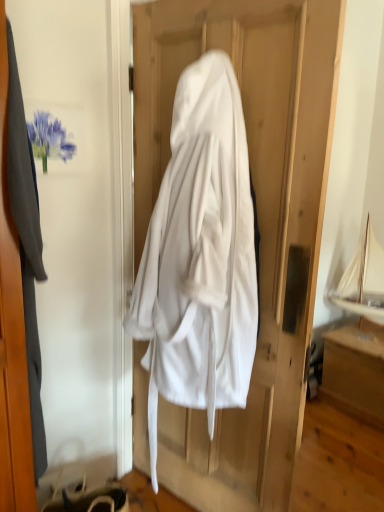
Find the location of a particular element. white fabric hanger at lower left is located at coordinates (79, 486).

Find the location of a particular element. white fabric hanger at lower left is located at coordinates (79, 486).

Is point (320, 165) closer or farther from the camera than point (114, 358)?

Clearly, point (320, 165) is closer to the camera than point (114, 358).

Is white cloth at center shorter than gray fabric screen door at left?

No.

Which is more to the left, white cloth at center or gray fabric screen door at left?

Positioned to the left is gray fabric screen door at left.

In the scene shown: From a real-world perspective, is white cloth at center on gray fabric screen door at left?

No.

Does white cloth at center have a larger size compared to wooden drawer at lower right?

Yes, white cloth at center is bigger than wooden drawer at lower right.

Where is `drawer directly beneath the white cloth at center (from a real-world perspective)`? drawer directly beneath the white cloth at center (from a real-world perspective) is located at coordinates (354, 382).

Considering the points (291, 274) and (327, 368), which point is behind, point (291, 274) or point (327, 368)?

Point (327, 368)

Are white fabric hanger at lower left and wooden drawer at lower right making contact?

No, white fabric hanger at lower left is not in contact with wooden drawer at lower right.

Based on their positions, is white fabric hanger at lower left located to the left or right of wooden drawer at lower right?

Clearly, white fabric hanger at lower left is on the left of wooden drawer at lower right in the image.

Is white fabric hanger at lower left thinner than wooden drawer at lower right?

Correct, the width of white fabric hanger at lower left is less than that of wooden drawer at lower right.

Where is `hanger in front of the wooden drawer at lower right`? hanger in front of the wooden drawer at lower right is located at coordinates (79, 486).

Does gray fabric screen door at left have a larger size compared to white fabric hanger at lower left?

Indeed, gray fabric screen door at left has a larger size compared to white fabric hanger at lower left.

Measure the distance between gray fabric screen door at left and white fabric hanger at lower left.

20.13 inches.

Is gray fabric screen door at left not inside white fabric hanger at lower left?

Absolutely, gray fabric screen door at left is external to white fabric hanger at lower left.

How different are the orientations of gray fabric screen door at left and white fabric hanger at lower left in degrees?

There is a 90.5-degree angle between the facing directions of gray fabric screen door at left and white fabric hanger at lower left.

Considering the points (82, 478) and (19, 163), which point is behind, point (82, 478) or point (19, 163)?

The point (82, 478) is behind.

This screenshot has width=384, height=512. I want to click on garment located above the white fabric hanger at lower left (from a real-world perspective), so click(x=26, y=243).

From a real-world perspective, is white fabric hanger at lower left on matte gray coat at left?

Incorrect, from a real-world perspective, white fabric hanger at lower left is lower than matte gray coat at left.

From the picture: Is white fabric hanger at lower left oriented towards matte gray coat at left?

No, white fabric hanger at lower left is not oriented towards matte gray coat at left.

Is white fabric hanger at lower left facing away from white cloth at center?

white fabric hanger at lower left is not turned away from white cloth at center.

You are a GUI agent. You are given a task and a screenshot of the screen. Output one action in this format:
    pyautogui.click(x=<x>, y=<y>)
    Task: Click on the hanger on the left side of white cloth at center
    This screenshot has width=384, height=512.
    Given the screenshot: What is the action you would take?
    tap(79, 486)

Does point (96, 468) come farther from viewer compared to point (225, 504)?

Yes.

How many degrees apart are the facing directions of gray fabric screen door at left and matte gray coat at left?

90.7 degrees.

Is gray fabric screen door at left bigger or smaller than matte gray coat at left?

Clearly, gray fabric screen door at left is larger in size than matte gray coat at left.

From a real-world perspective, is gray fabric screen door at left beneath matte gray coat at left?

No.

Considering the sizes of objects gray fabric screen door at left and matte gray coat at left in the image provided, who is thinner, gray fabric screen door at left or matte gray coat at left?

Thinner between the two is gray fabric screen door at left.

Find the location of a particular element. The width and height of the screenshot is (384, 512). door that is on the right side of gray fabric screen door at left is located at coordinates (258, 219).

Find the location of a particular element. This screenshot has height=512, width=384. drawer directly beneath the white cloth at center (from a real-world perspective) is located at coordinates (354, 382).

Estimate the real-world distances between objects in this image. Which object is closer to matte gray coat at left, white cloth at center or white fabric hanger at lower left?

Answer: white fabric hanger at lower left is positioned closer to the anchor matte gray coat at left.

Which object lies further to the anchor point wooden drawer at lower right, matte gray coat at left or white cloth at center?

Among the two, matte gray coat at left is located further to wooden drawer at lower right.

Based on their spatial positions, is wooden drawer at lower right or matte gray coat at left closer to gray fabric screen door at left?

Among the two, matte gray coat at left is located nearer to gray fabric screen door at left.

Looking at this image, estimate the real-world distances between objects in this image. Which object is closer to white cloth at center, white fabric hanger at lower left or wooden drawer at lower right?

white fabric hanger at lower left is closer to white cloth at center.

From the image, which object appears to be nearer to wooden drawer at lower right, white cloth at center or white fabric hanger at lower left?

white cloth at center is positioned closer to the anchor wooden drawer at lower right.

In the scene shown: Which object lies nearer to the anchor point wooden drawer at lower right, white cloth at center or matte gray coat at left?

white cloth at center.

Based on their spatial positions, is gray fabric screen door at left or matte gray coat at left closer to white fabric hanger at lower left?

Among the two, gray fabric screen door at left is located nearer to white fabric hanger at lower left.

Looking at the image, which one is located closer to gray fabric screen door at left, white cloth at center or wooden drawer at lower right?

white cloth at center.

What are the coordinates of `door between white fabric hanger at lower left and wooden drawer at lower right` in the screenshot? It's located at (258, 219).

Locate an element on the screen. This screenshot has width=384, height=512. garment between gray fabric screen door at left and wooden drawer at lower right is located at coordinates (26, 243).

Locate an element on the screen. This screenshot has width=384, height=512. hanger situated between gray fabric screen door at left and wooden drawer at lower right from left to right is located at coordinates (79, 486).

Where is `door that lies between gray fabric screen door at left and white fabric hanger at lower left from top to bottom`? This screenshot has height=512, width=384. door that lies between gray fabric screen door at left and white fabric hanger at lower left from top to bottom is located at coordinates pos(258,219).